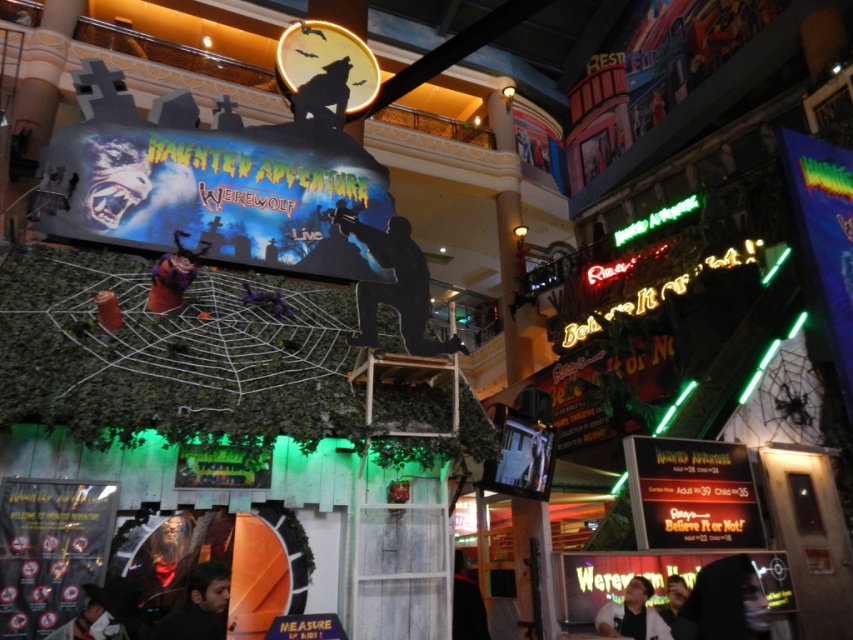
Which is behind, point (102, 602) or point (668, 616)?

Positioned behind is point (668, 616).

Is matte black jacket at lower left further to camera compared to smooth skin face at lower right?

No, it is not.

Find the location of a particular element. This screenshot has width=853, height=640. matte black jacket at lower left is located at coordinates (91, 620).

What do you see at coordinates (724, 604) in the screenshot?
I see `dark matte hood at lower right` at bounding box center [724, 604].

Between dark matte hood at lower right and dark hair at lower left, which one has less height?

dark hair at lower left is shorter.

Who is more forward, (683,611) or (166,627)?

Point (166,627) is more forward.

Where is `dark matte hood at lower right`? dark matte hood at lower right is located at coordinates (724, 604).

Is black matte silhouette at center positioned before black fabric person at center?

Yes.

Does black matte silhouette at center appear over black fabric person at center?

Yes.

Locate an element on the screen. black matte silhouette at center is located at coordinates (393, 284).